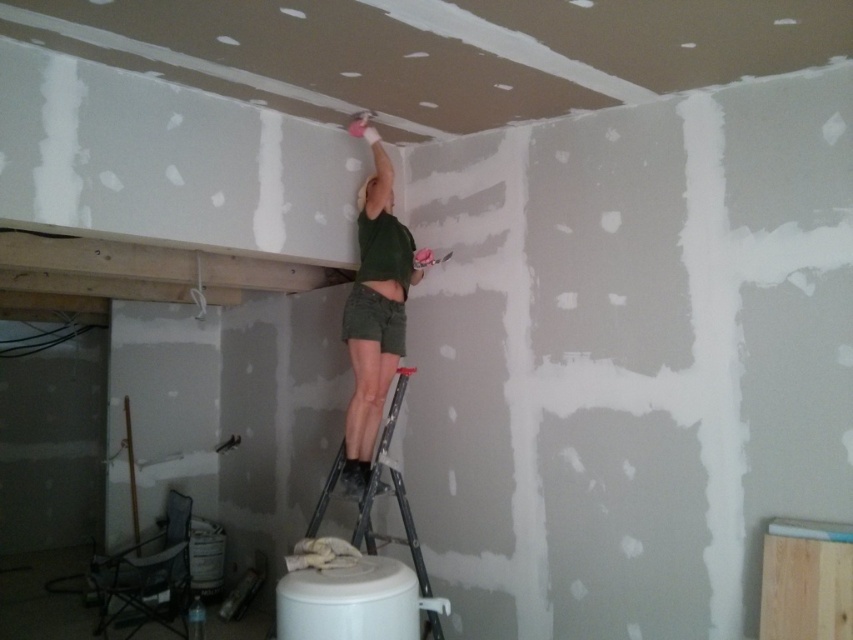
Between green matte shirt at upper center and metallic silver ladder at center, which one appears on the left side from the viewer's perspective?

From the viewer's perspective, metallic silver ladder at center appears more on the left side.

Who is lower down, green matte shirt at upper center or metallic silver ladder at center?

metallic silver ladder at center is lower down.

Is point (376, 310) more distant than point (407, 513)?

Yes, it is behind point (407, 513).

Where is `green matte shirt at upper center`? green matte shirt at upper center is located at coordinates (374, 308).